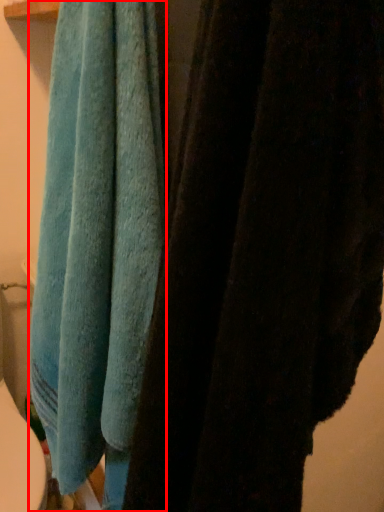
Question: Considering the relative positions of towel (annotated by the red box) and towel in the image provided, where is towel (annotated by the red box) located with respect to the staircase?

Choices:
 (A) left
 (B) right

Answer: (A)